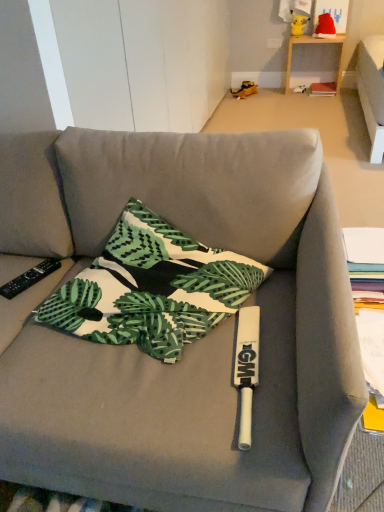
Find the location of a particular element. This screenshot has width=384, height=512. blank space above hardcover book at center (from a real-world perspective) is located at coordinates (326, 85).